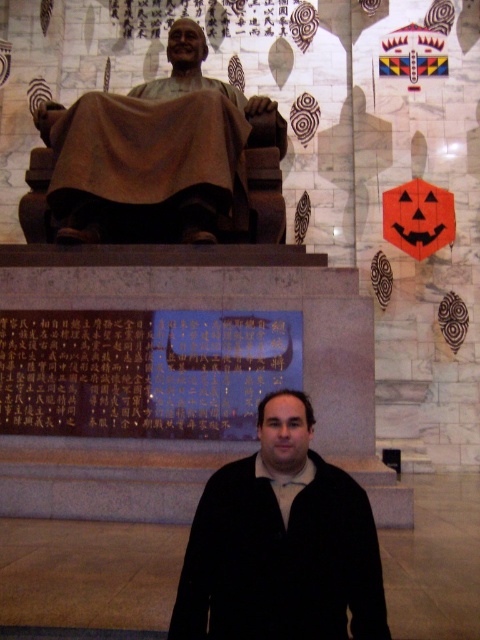
Looking at this image, you are an interior designer planning to place a new lamp in the room. The lamp requires a stable surface that is at least 1.5 meters tall. Based on the scene, which object between the black matte jacket at center and the bronze statue at center can support the lamp?

The bronze statue at center is taller than the black matte jacket at center. Since the lamp needs a surface at least 1.5 meters tall, the bronze statue at center is the suitable option if its height meets the requirement.

You are a visitor standing in front of the bronze statue at center and the black matte jacket at center. Which object is positioned lower in the scene?

The black matte jacket at center is located below the bronze statue at center, so it is positioned lower in the scene.